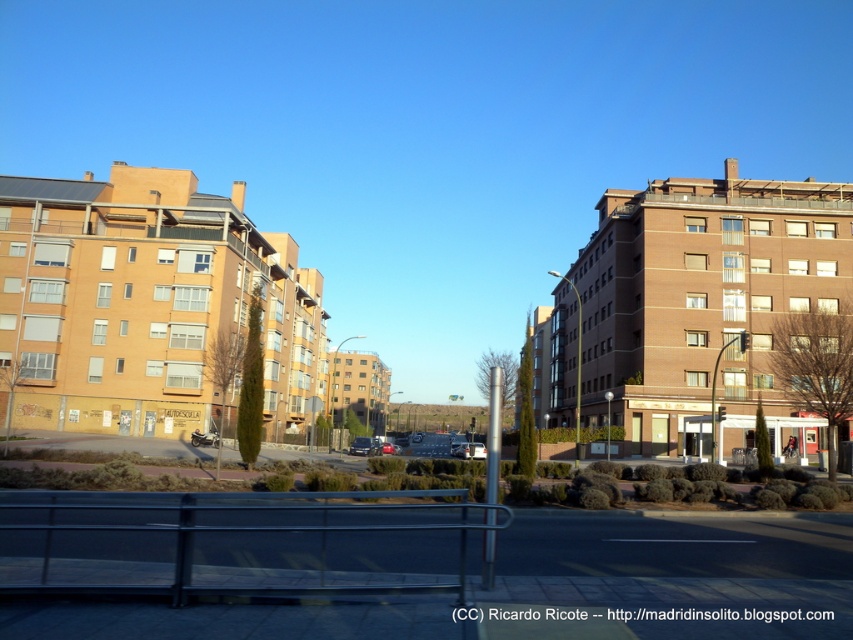
You are a pedestrian standing on the sidewalk and see both the silver metallic car at center and the shiny metallic car at center. Which car is positioned more to the right side?

The silver metallic car at center is positioned more to the right side than the shiny metallic car at center.

You are a driver looking to park your car in the urban area shown. You see two cars at the center of the scene, a metallic silver car at center and a shiny metallic car at center. Which car is more likely to be a compact model?

The metallic silver car at center is smaller than the shiny metallic car at center, so the metallic silver car at center is more likely to be a compact model.

You are a pedestrian standing on the pavement near the metallic railing. You see two cars at center, a metallic silver car at center and a shiny metallic car at center. Which one is higher up in the image?

The metallic silver car at center is located above the shiny metallic car at center in the image.